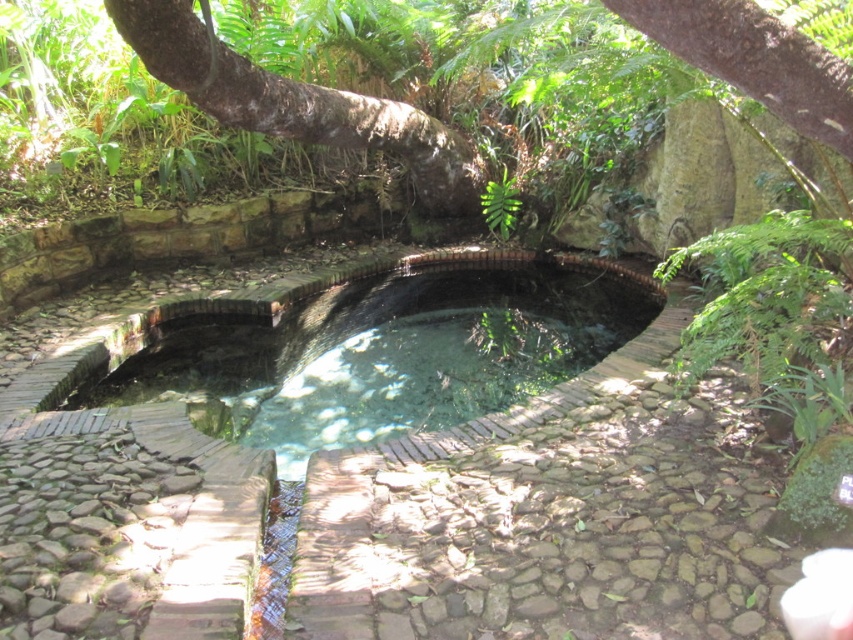
Consider the image. You are standing at the origin point of the coordinate system. You want to walk to the clear glass pool at center. What are the coordinates you need to move to reach it?

The clear glass pool at center is located at coordinates point (387, 349), so you need to move to those coordinates to reach it.

You are a landscape architect designing a new garden. You need to place a 1 meter wide decorative stone path between the brown rough bark tree at upper center and the green leafy fern at center. Is there enough space between them to fit the path?

The distance between the brown rough bark tree at upper center and the green leafy fern at center is 78.68 centimeters. Since the path requires 1 meter of space, there isn not enough room to fit the path between them.

You are standing at the edge of the pool and want to reach both points marked in the image. Which point, point (618, 294) or point (497, 234), is closer to you?

Point (618, 294) is closer to the camera than point (497, 234), so it is closer to you.